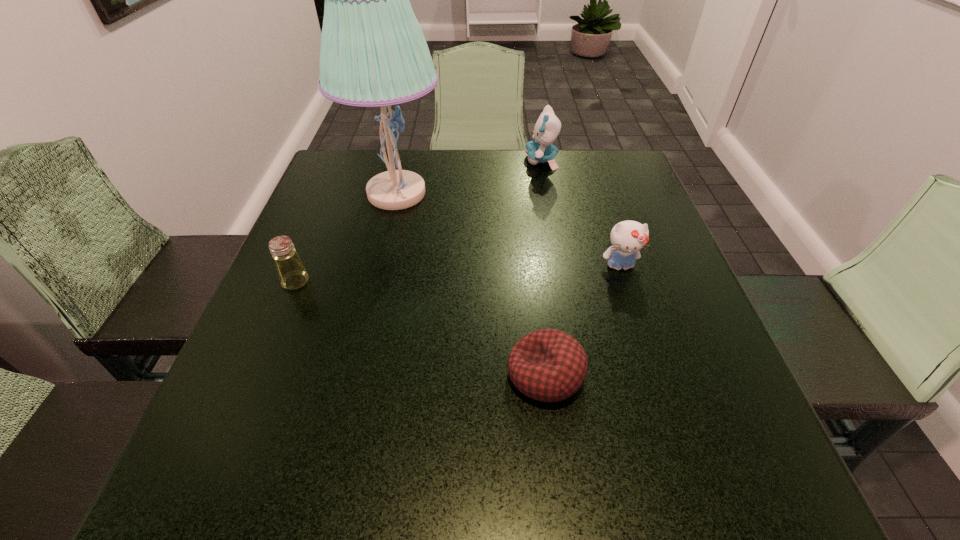
At what (x,y) coordinates should I click in order to perform the action: click on free space between the shortest object and the saltshaker. Please return your answer as a coordinate pair (x, y). Looking at the image, I should click on (420, 328).

I want to click on vacant area that lies between the rightmost object and the saltshaker, so click(458, 274).

The height and width of the screenshot is (540, 960). What are the coordinates of `free point between the fourth object from right to left and the beanbag` in the screenshot? It's located at point(471,284).

Where is `unoccupied position between the tallest object and the nearest object`? unoccupied position between the tallest object and the nearest object is located at coordinates (471, 284).

Where is `vacant area that lies between the farther kitten and the rightmost object`? This screenshot has height=540, width=960. vacant area that lies between the farther kitten and the rightmost object is located at coordinates (581, 213).

This screenshot has height=540, width=960. What are the coordinates of `empty space that is in between the leftmost object and the lamp` in the screenshot? It's located at (347, 238).

I want to click on free space between the shortest object and the saltshaker, so click(x=420, y=328).

Image resolution: width=960 pixels, height=540 pixels. Find the location of `vacant space that is in between the tallest object and the shorter kitten`. vacant space that is in between the tallest object and the shorter kitten is located at coordinates (508, 230).

The width and height of the screenshot is (960, 540). What are the coordinates of `vacant space that's between the lamp and the left kitten` in the screenshot? It's located at (469, 177).

Identify which object is located as the second nearest to the fourth object from right to left. Please provide its 2D coordinates. Your answer should be formatted as a tuple, i.e. [(x, y)], where the tuple contains the x and y coordinates of a point satisfying the conditions above.

[(547, 128)]